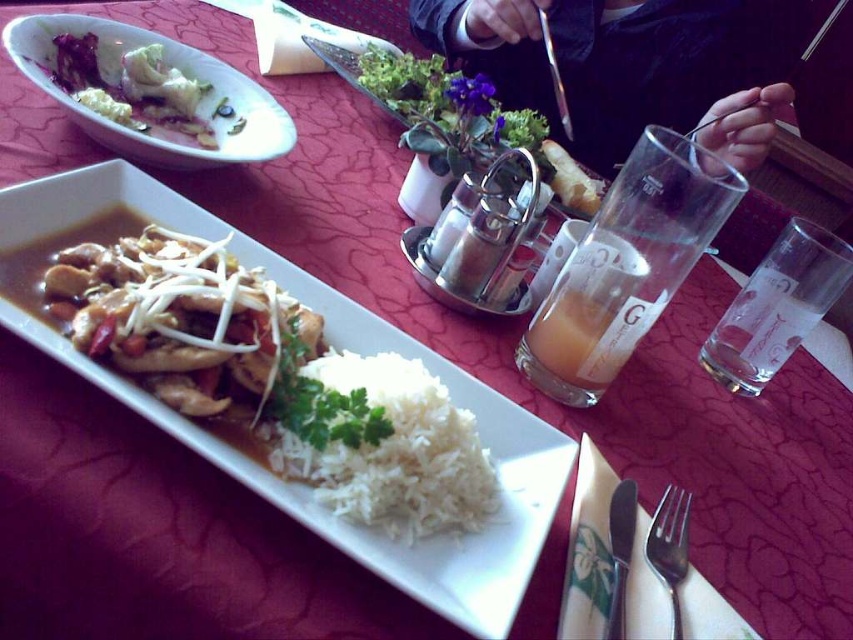
Question: Based on their relative distances, which object is farther from the brushed metal fork at upper center?

Choices:
 (A) dark suit jacket at upper center
 (B) satin silver fork at lower right

Answer: (B)

Question: Is the position of white creamy mashed potatoes at upper left less distant than that of satin silver fork at lower right?

Choices:
 (A) yes
 (B) no

Answer: (B)

Question: Which point is farther to the camera?

Choices:
 (A) white polished rice at center
 (B) satin silver fork at lower right
 (C) polished metal knife at lower right

Answer: (B)

Question: Observing the image, what is the correct spatial positioning of translucent glass at center in reference to brushed metal fork at upper center?

Choices:
 (A) above
 (B) below

Answer: (B)

Question: Is translucent glass at right smaller than satin silver fork at lower right?

Choices:
 (A) no
 (B) yes

Answer: (A)

Question: Which of the following is the closest to the observer?

Choices:
 (A) brushed metal fork at upper center
 (B) white creamy mashed potatoes at upper left
 (C) dark suit jacket at upper center
 (D) polished metal knife at lower right

Answer: (D)